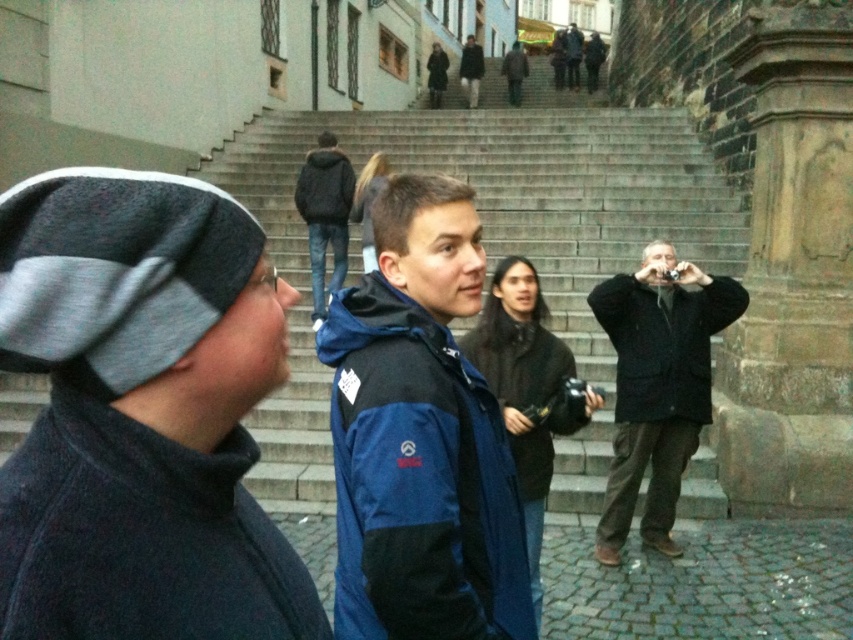
Does black matte sweatshirt at right lie in front of dark gray fleece sweatshirt at upper center?

That is True.

Does black matte sweatshirt at right appear on the left side of dark gray fleece sweatshirt at upper center?

In fact, black matte sweatshirt at right is to the right of dark gray fleece sweatshirt at upper center.

What do you see at coordinates (663, 344) in the screenshot?
I see `black matte sweatshirt at right` at bounding box center [663, 344].

This screenshot has height=640, width=853. Find the location of `black matte sweatshirt at right`. black matte sweatshirt at right is located at coordinates (663, 344).

Does smooth stone stairs at center lie in front of dark gray fleece sweatshirt at upper center?

Yes, smooth stone stairs at center is closer to the viewer.

Between smooth stone stairs at center and dark gray fleece sweatshirt at upper center, which one has less height?

Standing shorter between the two is dark gray fleece sweatshirt at upper center.

Between point (676, 120) and point (326, 148), which one is positioned behind?

Point (676, 120)

I want to click on smooth stone stairs at center, so click(492, 236).

Does dark gray fleece beanie at left appear on the left side of black matte sweatshirt at right?

Yes, dark gray fleece beanie at left is to the left of black matte sweatshirt at right.

Between dark gray fleece beanie at left and black matte sweatshirt at right, which one has more height?

black matte sweatshirt at right

At what (x,y) coordinates should I click in order to perform the action: click on dark gray fleece beanie at left. Please return your answer as a coordinate pair (x, y). The height and width of the screenshot is (640, 853). Looking at the image, I should click on (140, 416).